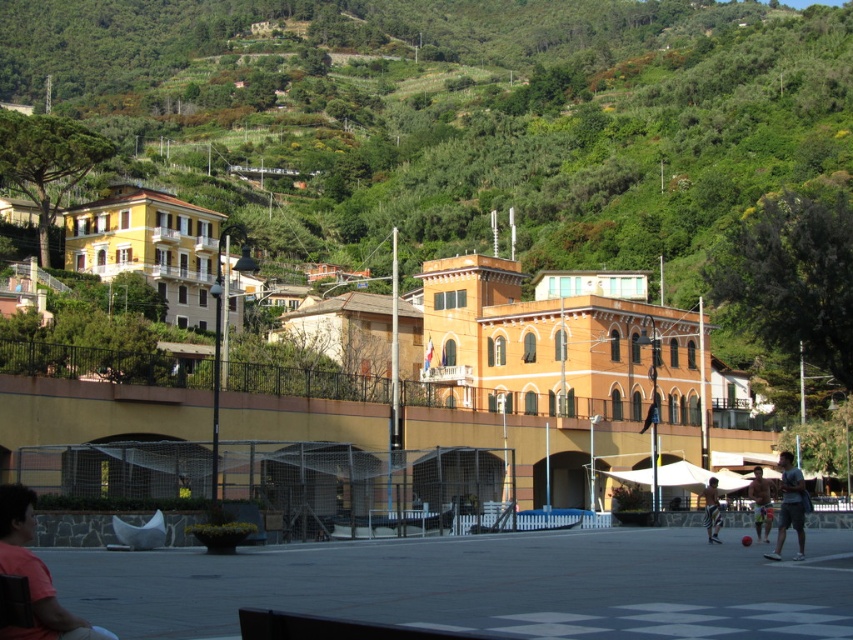
Question: Which object appears closest to the camera in this image?

Choices:
 (A) matte pink shirt at lower left
 (B) tan skin man at center
 (C) dark gray fabric shorts at lower right

Answer: (A)

Question: Which point is farther to the camera?

Choices:
 (A) (798, 474)
 (B) (717, 524)

Answer: (B)

Question: Is matte pink shirt at lower left wider than tan skin man at center?

Choices:
 (A) no
 (B) yes

Answer: (A)

Question: Can you confirm if matte pink shirt at lower left is wider than dark gray fabric shorts at lower right?

Choices:
 (A) yes
 (B) no

Answer: (B)

Question: Is dark gray fabric shorts at lower right wider than striped shorts at lower right?

Choices:
 (A) no
 (B) yes

Answer: (B)

Question: Which object is closer to the camera taking this photo?

Choices:
 (A) dark gray fabric shorts at lower right
 (B) striped shorts at lower right
 (C) matte pink shirt at lower left
 (D) tan skin man at center

Answer: (C)